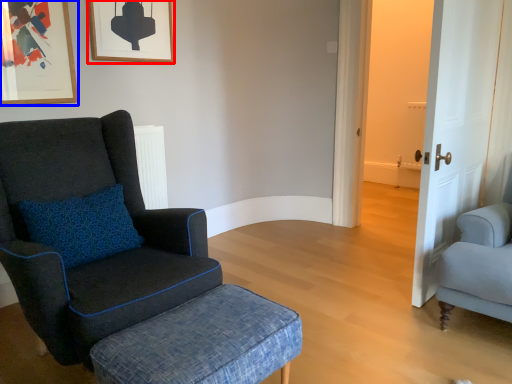
Question: Which point is closer to the camera, picture frame (highlighted by a red box) or picture frame (highlighted by a blue box)?

Choices:
 (A) picture frame
 (B) picture frame

Answer: (B)